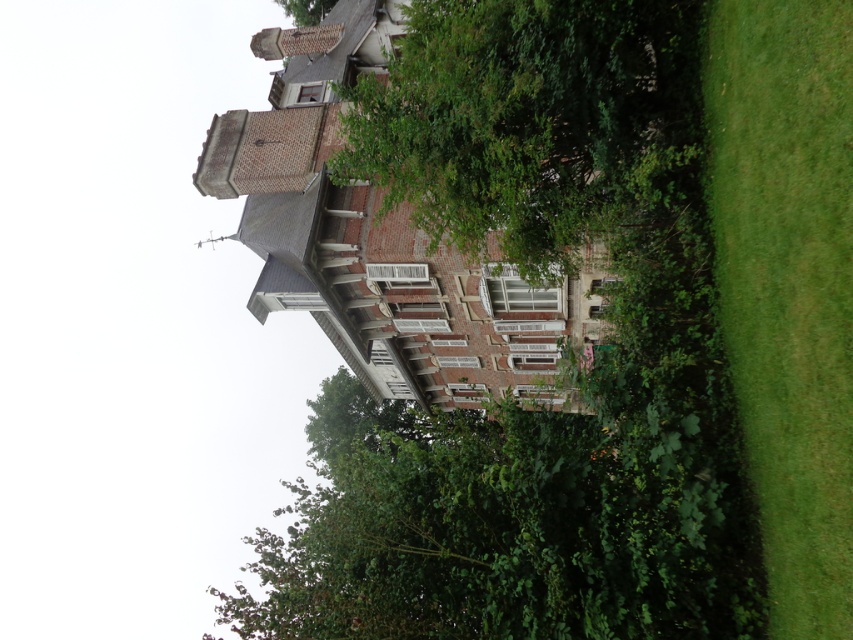
You are standing in front of the house and want to walk from the green leafy tree at center to the green grass at right. Which direction should you move relative to the tree?

You should move to the right relative to the green leafy tree at center because the green grass at right is located to its right side.

You are standing in front of the house and looking towards the green leafy tree at center and the green grass at right. Which object is higher in the scene?

The green leafy tree at center is higher than the green grass at right.

Based on the photo, you are standing in front of the house and want to plant a new flower bed. You have two options for locations based on the image. The first option is near the green leafy tree at center, and the second is near the green grass at right. Which location is closer to the front of the house?

The green leafy tree at center is closer to the front of the house because the green grass at right is behind it.